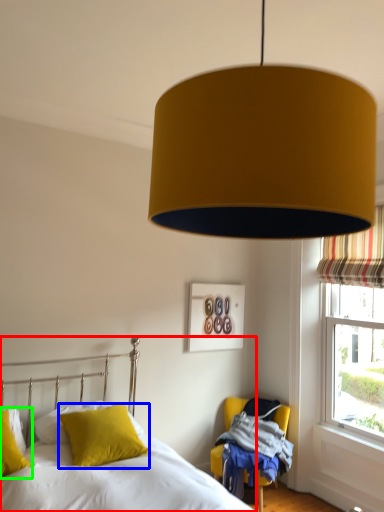
Question: Estimate the real-world distances between objects in this image. Which object is closer to bed (highlighted by a red box), pillow (highlighted by a blue box) or pillow (highlighted by a green box)?

Choices:
 (A) pillow
 (B) pillow

Answer: (A)